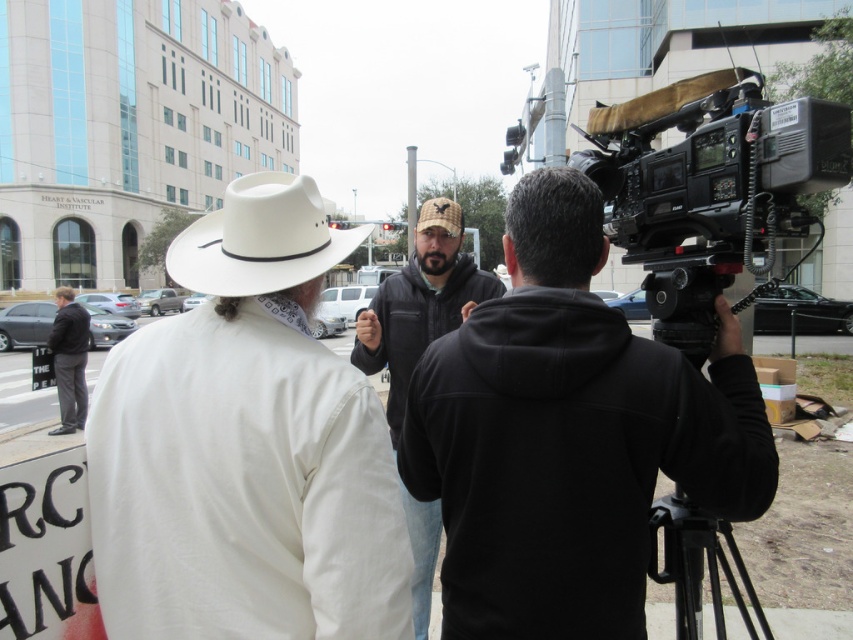
Is point (310, 550) positioned before point (569, 481)?

Yes, point (310, 550) is in front of point (569, 481).

This screenshot has height=640, width=853. Describe the element at coordinates (247, 445) in the screenshot. I see `white matte cowboy hat at upper left` at that location.

Is point (120, 616) closer to viewer compared to point (583, 301)?

Yes, it is.

Identify the location of white matte cowboy hat at upper left. The height and width of the screenshot is (640, 853). (247, 445).

Can you confirm if black plastic video camera at upper right is positioned below dark gray hoodie at center?

Incorrect, black plastic video camera at upper right is not positioned below dark gray hoodie at center.

Between point (837, 124) and point (450, 275), which one is positioned behind?

The point (450, 275) is more distant.

Where is `black plastic video camera at upper right`? The height and width of the screenshot is (640, 853). black plastic video camera at upper right is located at coordinates (711, 188).

Between point (213, 291) and point (701, 568), which one is positioned behind?

Positioned behind is point (701, 568).

Who is positioned more to the right, white leather cowboy hat at left or black matte tripod at right?

black matte tripod at right is more to the right.

Which is behind, point (296, 230) or point (692, 636)?

The point (692, 636) is more distant.

This screenshot has height=640, width=853. What are the coordinates of `white leather cowboy hat at left` in the screenshot? It's located at (260, 237).